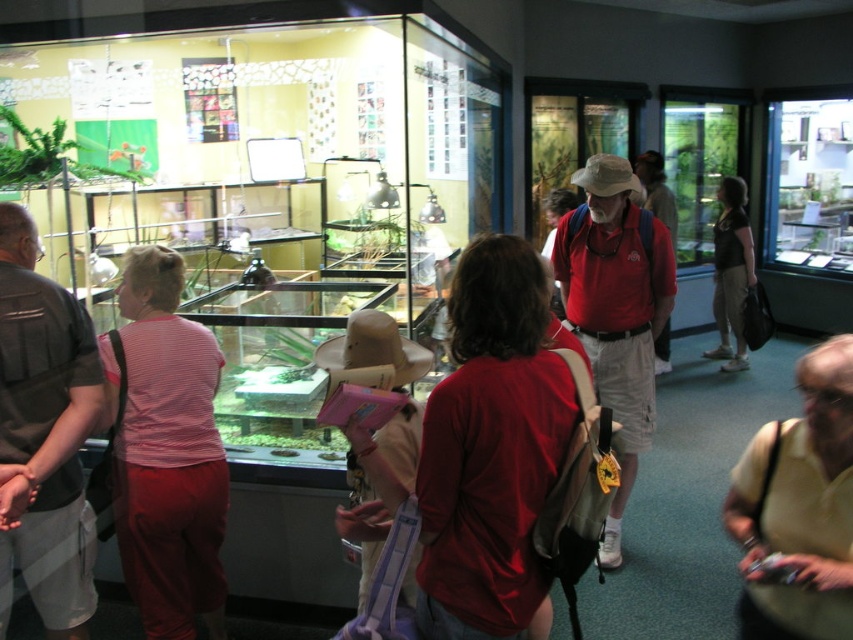
Between pink fabric hat at center and yellow smooth shirt at lower right, which one is positioned lower?

Positioned lower is yellow smooth shirt at lower right.

Between point (9, 490) and point (824, 429), which one is positioned behind?

The point (9, 490) is more distant.

Between point (21, 243) and point (787, 516), which one is positioned in front?

Positioned in front is point (787, 516).

Locate an element on the screen. This screenshot has width=853, height=640. pink fabric hat at center is located at coordinates (44, 435).

Does matte red shirt at center appear on the right side of black cotton shirt at center?

Incorrect, matte red shirt at center is not on the right side of black cotton shirt at center.

Measure the distance from matte red shirt at center to black cotton shirt at center.

2.91 meters

Where is `matte red shirt at center`? Image resolution: width=853 pixels, height=640 pixels. matte red shirt at center is located at coordinates (616, 307).

Between pink striped shirt at center and black cotton shirt at center, which one appears on the right side from the viewer's perspective?

black cotton shirt at center

Which of these two, pink striped shirt at center or black cotton shirt at center, stands taller?

Standing taller between the two is black cotton shirt at center.

Is point (138, 420) positioned behind point (735, 241)?

No, it is not.

You are a GUI agent. You are given a task and a screenshot of the screen. Output one action in this format:
    pyautogui.click(x=<x>, y=<y>)
    Task: Click on the pink striped shirt at center
    The width and height of the screenshot is (853, 640).
    Given the screenshot: What is the action you would take?
    pyautogui.click(x=167, y=454)